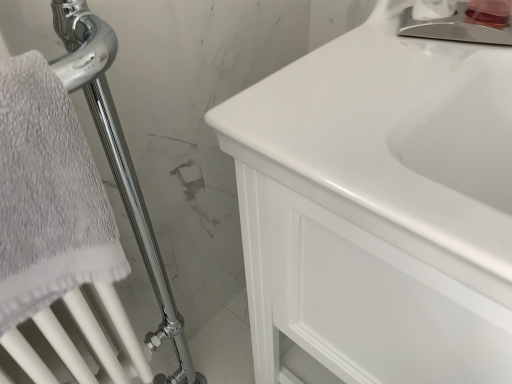
Question: Is point (504, 6) positioned closer to the camera than point (417, 99)?

Choices:
 (A) closer
 (B) farther

Answer: (B)

Question: From a real-world perspective, is pink plastic container at upper right, the second toiletry when ordered from left to right, positioned above or below white glossy cabinet at center?

Choices:
 (A) above
 (B) below

Answer: (A)

Question: Which object is the farthest from the chrome metallic shower at left?

Choices:
 (A) white glossy cabinet at center
 (B) pink plastic container at upper right, which is counted as the 1th toiletry, starting from the right
 (C) white glossy soap dispenser at upper right, which ranks as the first toiletry in left-to-right order
 (D) polished chrome faucet at upper right

Answer: (B)

Question: Estimate the real-world distances between objects in this image. Which object is closer to the white glossy soap dispenser at upper right, which ranks as the second toiletry in right-to-left order?

Choices:
 (A) white glossy cabinet at center
 (B) pink plastic container at upper right, the second toiletry when ordered from left to right
 (C) polished chrome faucet at upper right
 (D) chrome metallic shower at left

Answer: (B)